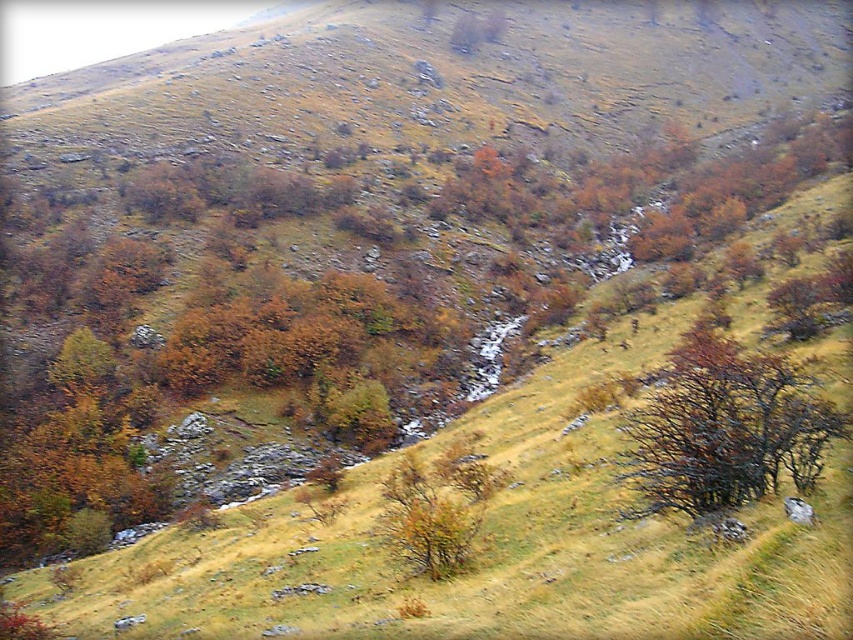
Question: Is brown matte tree at center-right bigger than green matte tree at center?

Choices:
 (A) no
 (B) yes

Answer: (B)

Question: Which object appears closest to the camera in this image?

Choices:
 (A) brown matte tree at center-right
 (B) green matte tree at center

Answer: (A)

Question: Which object appears closest to the camera in this image?

Choices:
 (A) green matte tree at center
 (B) brown matte tree at center-right

Answer: (B)

Question: Is brown matte tree at center-right positioned in front of green matte tree at center?

Choices:
 (A) yes
 (B) no

Answer: (A)

Question: Can you confirm if brown matte tree at center-right is positioned to the left of green matte tree at center?

Choices:
 (A) no
 (B) yes

Answer: (A)